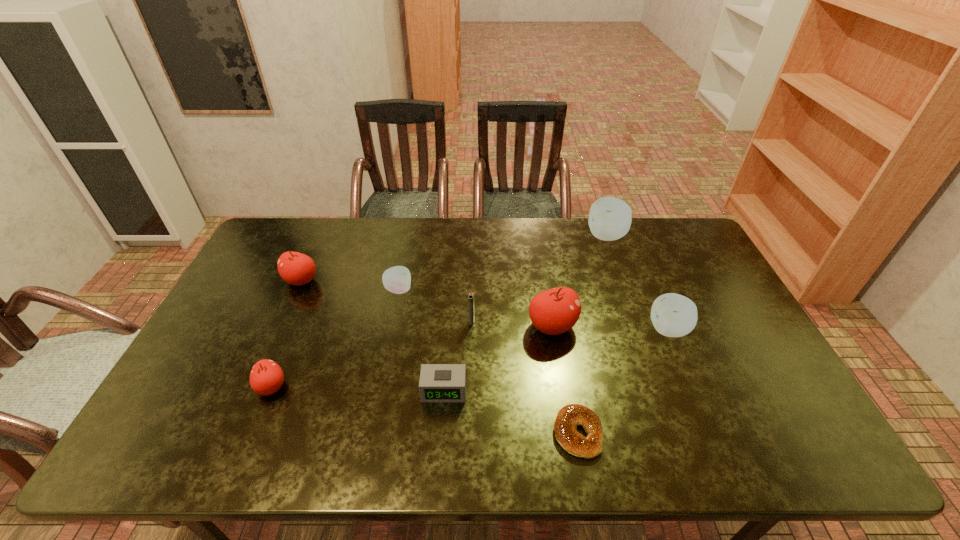
In the image, there is a desktop. At what (x,y) coordinates should I click in order to perform the action: click on free space at the far left corner. Please return your answer as a coordinate pair (x, y). Image resolution: width=960 pixels, height=540 pixels. Looking at the image, I should click on (276, 255).

In order to click on free space at the far right corner of the desktop in this screenshot , I will do `click(693, 243)`.

The width and height of the screenshot is (960, 540). Find the location of `vacant area that lies between the farthest object and the fourth object from left to right`. vacant area that lies between the farthest object and the fourth object from left to right is located at coordinates (525, 313).

At what (x,y) coordinates should I click in order to perform the action: click on free spot between the eighth tallest object and the tan bagel. Please return your answer as a coordinate pair (x, y). Looking at the image, I should click on (511, 412).

Identify the location of free point between the fifth object from right to left and the second farthest red apple. The height and width of the screenshot is (540, 960). (512, 323).

In order to click on free point between the second smallest red apple and the bagel in this screenshot , I will do `click(440, 357)`.

Identify the location of free space that is in between the second biggest white apple and the second shortest object. This screenshot has height=540, width=960. coord(557,360).

This screenshot has height=540, width=960. Find the location of `free space that is in between the second biggest white apple and the second smallest red apple`. free space that is in between the second biggest white apple and the second smallest red apple is located at coordinates (485, 305).

Find the location of `empty space that is in between the biggest red apple and the nearest object`. empty space that is in between the biggest red apple and the nearest object is located at coordinates (564, 380).

Find the location of `vacant area between the second farthest white apple and the rightmost red apple`. vacant area between the second farthest white apple and the rightmost red apple is located at coordinates click(475, 308).